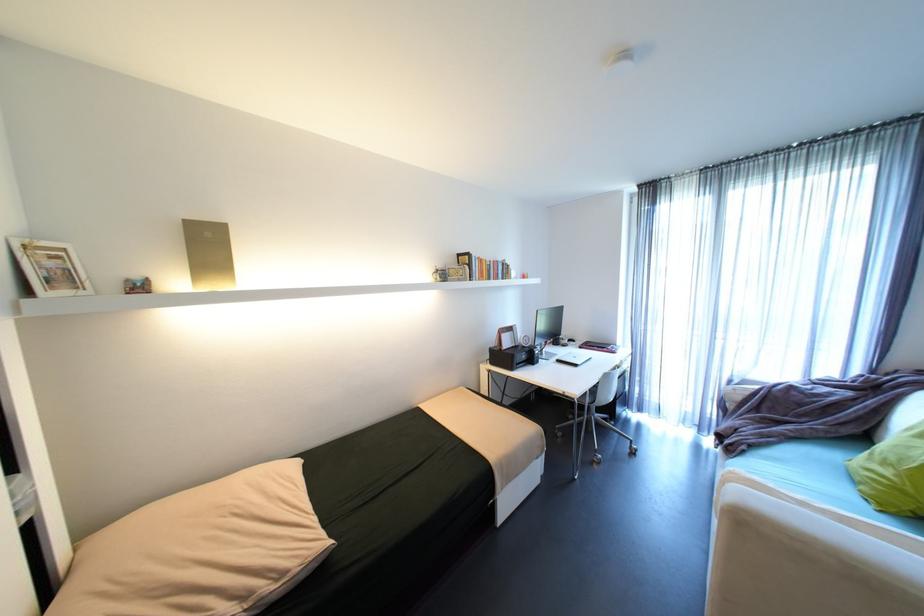
Where is `laptop computer`? Image resolution: width=924 pixels, height=616 pixels. laptop computer is located at coordinates (546, 325).